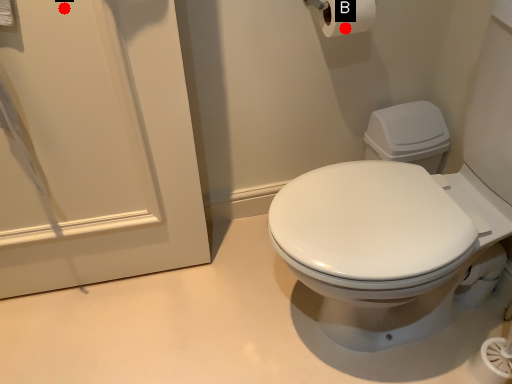
Question: Two points are circled on the image, labeled by A and B beside each circle. Which point appears farthest from the camera in this image?

Choices:
 (A) A is further
 (B) B is further

Answer: (B)